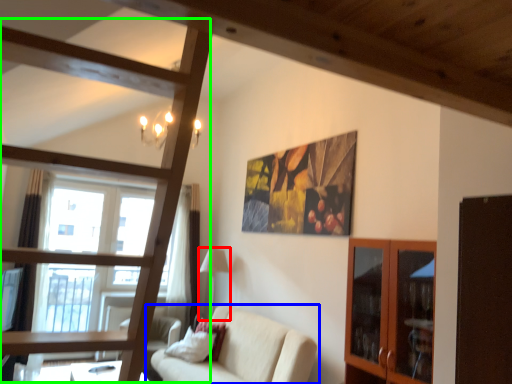
Question: Considering the real-world distances, which object is closest to lamp (highlighted by a red box)? studio couch (highlighted by a blue box) or bunk bed (highlighted by a green box).

Choices:
 (A) studio couch
 (B) bunk bed

Answer: (A)